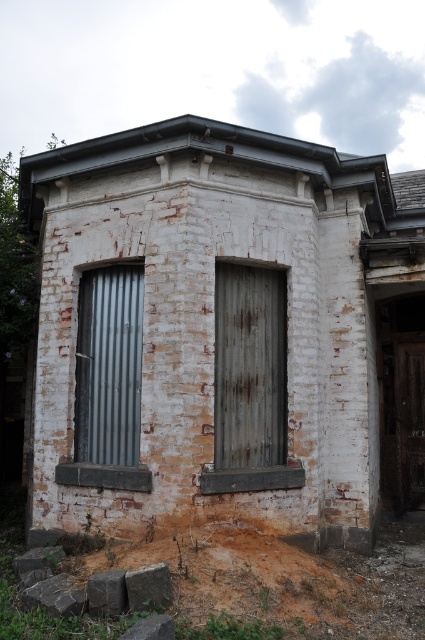
Question: Which is farther from the brown wooden door at right?

Choices:
 (A) rusty metal door at center
 (B) metallic corrugated door at left

Answer: (B)

Question: Does rusty metal door at center lie behind brown wooden door at right?

Choices:
 (A) no
 (B) yes

Answer: (A)

Question: Estimate the real-world distances between objects in this image. Which object is farther from the brown wooden door at right?

Choices:
 (A) rusty metal door at center
 (B) metallic corrugated door at left

Answer: (B)

Question: Is metallic corrugated door at left to the right of brown wooden door at right from the viewer's perspective?

Choices:
 (A) yes
 (B) no

Answer: (B)

Question: Which of the following is the closest to the observer?

Choices:
 (A) [121, 429]
 (B) [416, 429]

Answer: (A)

Question: Where is metallic corrugated door at left located in relation to brown wooden door at right in the image?

Choices:
 (A) above
 (B) below

Answer: (A)